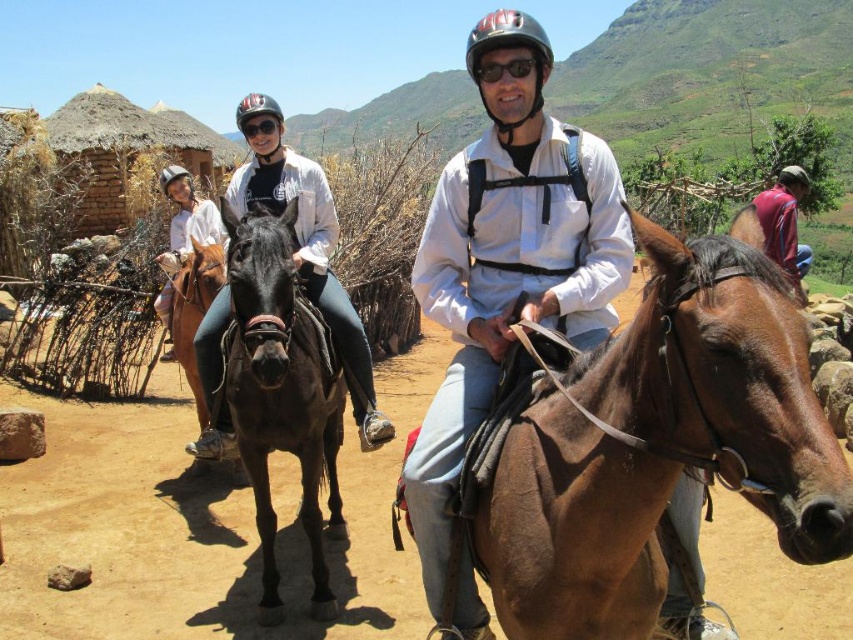
Does brushed metal helmet at upper center have a lesser height compared to purple fabric shirt at upper right?

No, brushed metal helmet at upper center is not shorter than purple fabric shirt at upper right.

Can you confirm if brushed metal helmet at upper center is smaller than purple fabric shirt at upper right?

No.

Locate an element on the screen. brushed metal helmet at upper center is located at coordinates (312, 260).

Find the location of a particular element. brushed metal helmet at upper center is located at coordinates (312, 260).

Which is in front, point (170, 253) or point (787, 243)?

Point (170, 253) is in front.

Can you confirm if matte white shirt at left is bigger than purple fabric shirt at upper right?

Yes.

Between point (167, 189) and point (769, 208), which one is positioned in front?

Point (167, 189) is more forward.

The width and height of the screenshot is (853, 640). In order to click on matte white shirt at left in this screenshot , I will do `click(183, 230)`.

Between matte white shirt at left and black matte goggles at upper center, which one is positioned lower?

matte white shirt at left is below.

Which is in front, point (210, 218) or point (276, 122)?

Point (276, 122) is in front.

The height and width of the screenshot is (640, 853). Identify the location of matte white shirt at left. (183, 230).

Where is `matte white shirt at left`? The height and width of the screenshot is (640, 853). matte white shirt at left is located at coordinates (183, 230).